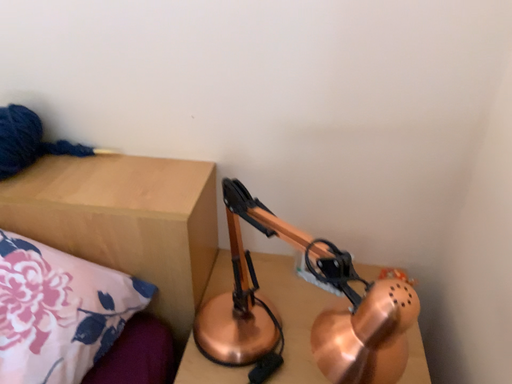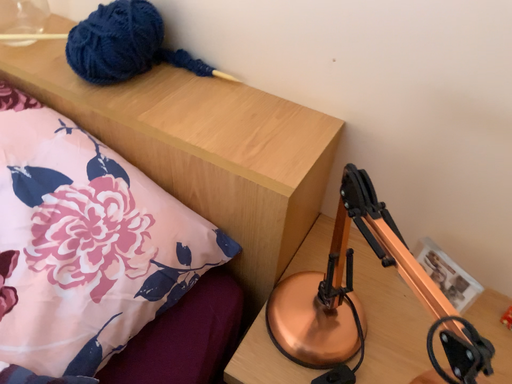
Question: How did the camera likely rotate when shooting the video?

Choices:
 (A) rotated left
 (B) rotated right

Answer: (A)